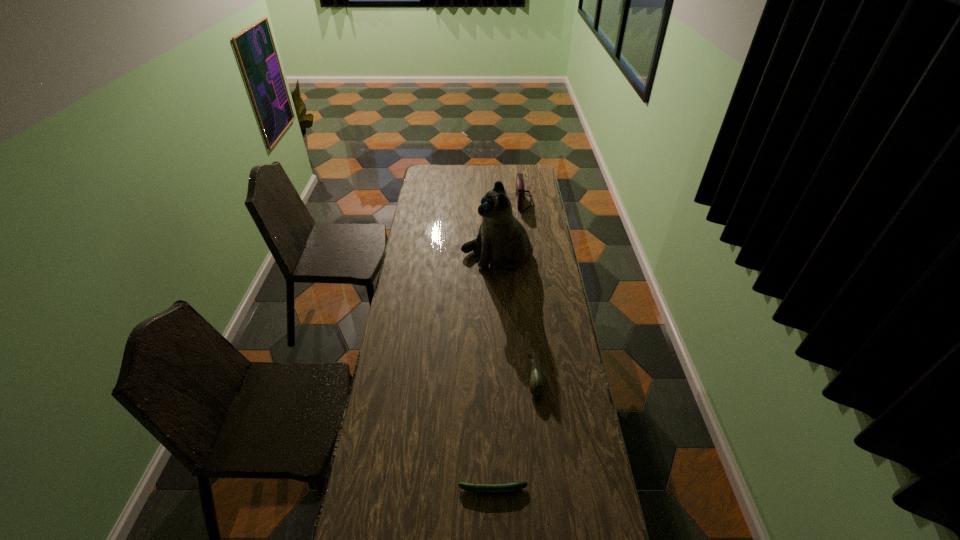
Where is `cat`? cat is located at coordinates (502, 239).

The image size is (960, 540). I want to click on the second farthest object, so click(x=502, y=239).

This screenshot has height=540, width=960. Identify the location of shoulder bag. (520, 191).

Where is `the farthest object`? Image resolution: width=960 pixels, height=540 pixels. the farthest object is located at coordinates (520, 191).

This screenshot has height=540, width=960. Identify the location of the taller zucchini. (537, 385).

The height and width of the screenshot is (540, 960). Find the location of `the farther zucchini`. the farther zucchini is located at coordinates (537, 385).

The image size is (960, 540). Identify the location of the shorter zucchini. (511, 487).

Locate an element on the screen. the shortest object is located at coordinates (511, 487).

I want to click on vacant space situated at the face of the cat, so pos(430,256).

Where is `vacant space situated at the face of the cat`? The height and width of the screenshot is (540, 960). vacant space situated at the face of the cat is located at coordinates (446, 256).